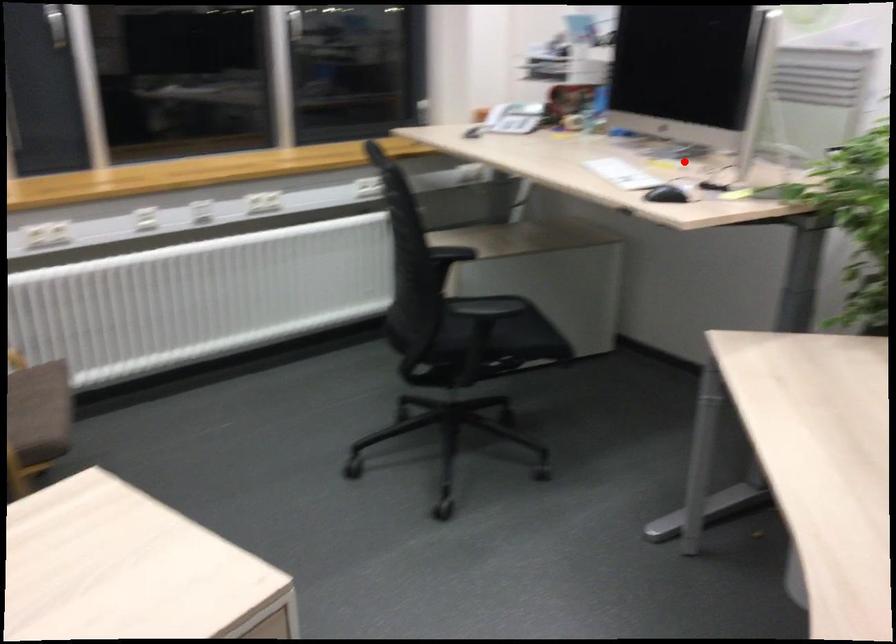
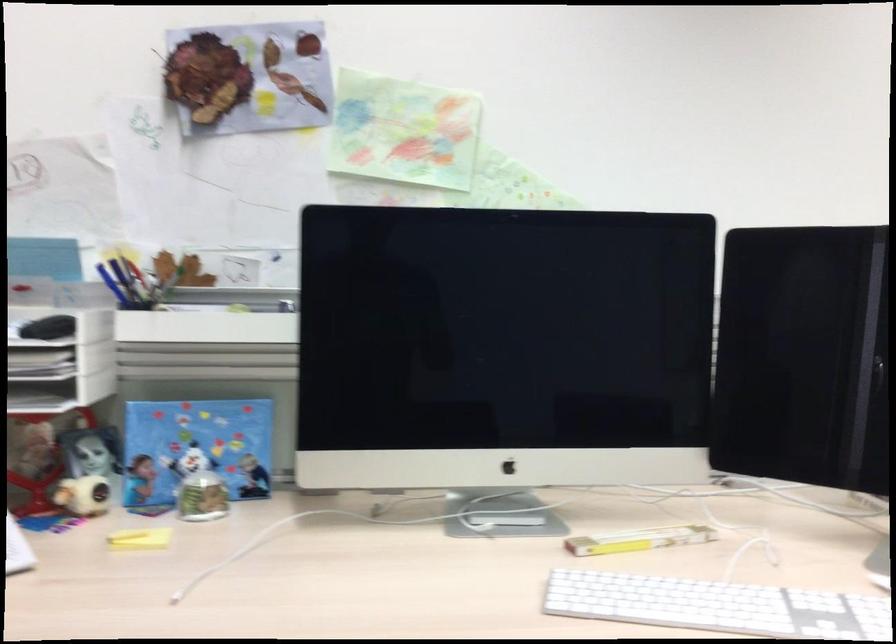
Question: I am providing you with two images of the same scene from different viewpoints. Given a red point in image1, look at the same physical point in image2. Is it:

Choices:
 (A) Closer to the viewpoint
 (B) Farther from the viewpoint

Answer: (A)